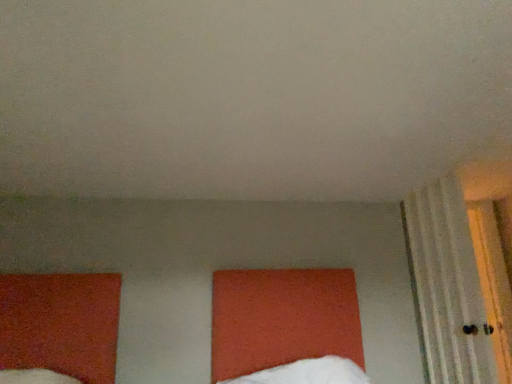
What do you see at coordinates (448, 287) in the screenshot? I see `white textured curtain at right` at bounding box center [448, 287].

I want to click on white textured curtain at right, so click(x=448, y=287).

Measure the distance between point (435, 339) and camera.

A distance of 2.64 meters exists between point (435, 339) and camera.

What is the approximate height of white textured curtain at right?

It is 4.14 feet.

The image size is (512, 384). I want to click on white textured curtain at right, so click(448, 287).